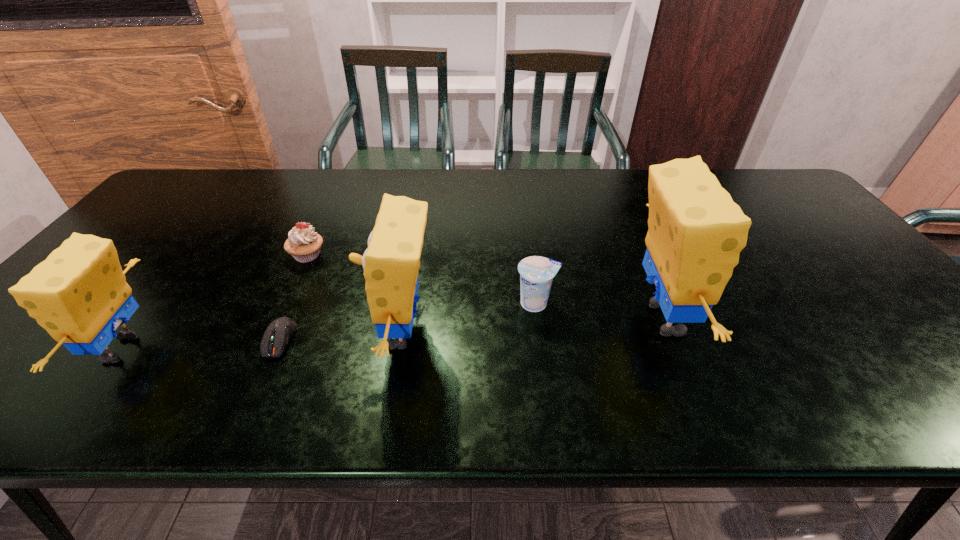
The sponges are evenly distributed in the image. To maintain this, where would you place another sponge on the right? Please point to a free space. Please provide its 2D coordinates. Your answer should be formatted as a tuple, i.e. [(x, y)], where the tuple contains the x and y coordinates of a point satisfying the conditions above.

[(908, 306)]